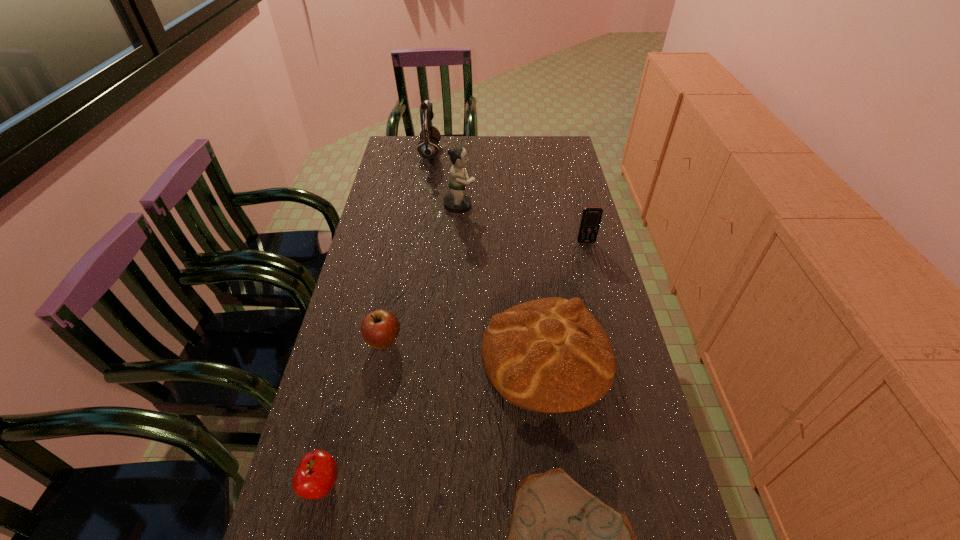
Find the location of a particular element. This screenshot has width=960, height=540. earphone is located at coordinates (428, 148).

This screenshot has height=540, width=960. I want to click on figurine, so click(456, 202).

The width and height of the screenshot is (960, 540). Identify the location of the second farthest object. (456, 202).

This screenshot has height=540, width=960. In order to click on the fifth nearest object in this screenshot , I will do `click(591, 217)`.

Find the location of a particular element. The height and width of the screenshot is (540, 960). bread is located at coordinates (551, 355).

This screenshot has height=540, width=960. Identify the location of the taller apple. (380, 328).

At what (x,y) coordinates should I click in order to perform the action: click on the nearer apple. Please return your answer as a coordinate pair (x, y). The image size is (960, 540). Looking at the image, I should click on (316, 474).

At what (x,y) coordinates should I click in order to perform the action: click on vacant point located on the ear pads of the earphone. Please return your answer as a coordinate pair (x, y). This screenshot has width=960, height=540. Looking at the image, I should click on (513, 153).

Find the location of a particular element. This screenshot has height=540, width=960. vacant space situated 0.380m on the front-facing side of the second farthest object is located at coordinates 586,206.

Where is `vacant space located 0.280m on the screen of the cellular telephone`? The height and width of the screenshot is (540, 960). vacant space located 0.280m on the screen of the cellular telephone is located at coordinates (604, 310).